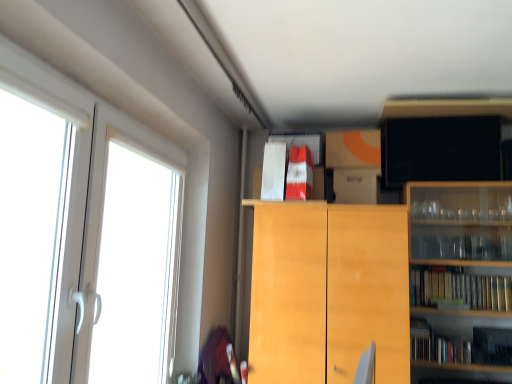
Question: From a real-world perspective, relative to white plastic screen door at left, is light wood cabinet at center, which appears as the 4th cabinetry when viewed from the top, vertically above or below?

Choices:
 (A) above
 (B) below

Answer: (B)

Question: Relative to white plastic screen door at left, is light wood cabinet at center, which appears as the 4th cabinetry when viewed from the top, in front or behind?

Choices:
 (A) front
 (B) behind

Answer: (B)

Question: Which object is the closest to the red glossy book at upper center, arranged as the second book when viewed from the left?

Choices:
 (A) white cardboard box at upper center, placed as the third cabinetry when sorted from top to bottom
 (B) white plastic screen door at left
 (C) orange matte cardboard box at upper center, which is the second cabinetry in top-to-bottom order
 (D) white paper bag at upper center, arranged as the third book when viewed from the right
 (E) hardcover books at right, the 3th book viewed from the top

Answer: (D)

Question: Which object is the closest to the red glossy book at upper center, placed as the 3th book when sorted from bottom to top?

Choices:
 (A) white cardboard box at upper center, placed as the third cabinetry when sorted from top to bottom
 (B) white paper bag at upper center, acting as the first book starting from the left
 (C) light wood cabinet at center, the 1th cabinetry positioned from the bottom
 (D) hardcover books at right, which appears as the 1th book when ordered from the bottom
 (E) black matte tv at upper right, positioned as the 4th cabinetry in bottom-to-top order

Answer: (B)